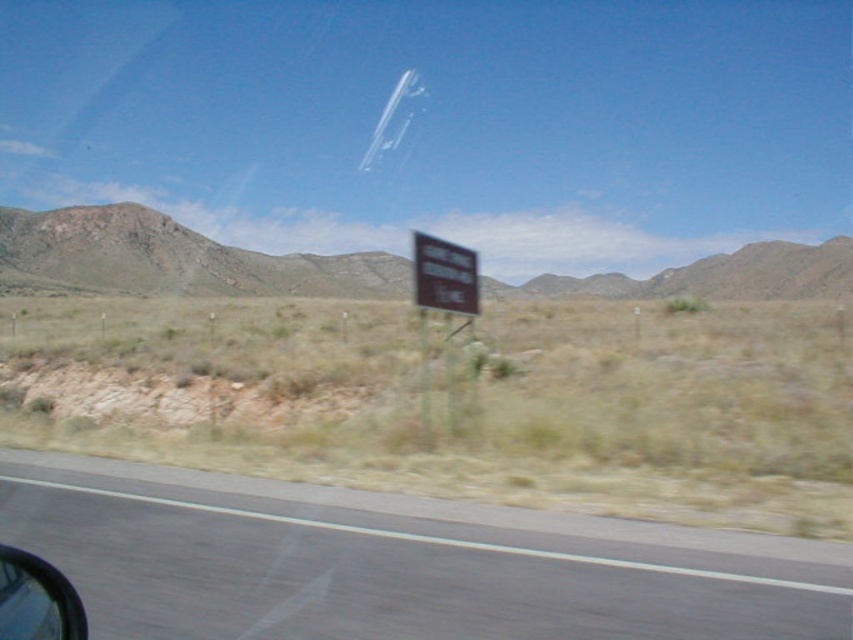
Is point (74, 429) less distant than point (436, 275)?

No, (74, 429) is further to viewer.

Who is more forward, (727, 433) or (448, 248)?

Point (727, 433)

Locate an element on the screen. This screenshot has width=853, height=640. brown grassland at center is located at coordinates (459, 401).

Does brown grassland at center come behind brown matte sign at center?

No, brown grassland at center is closer to the viewer.

Between point (770, 506) and point (415, 300), which one is positioned in front?

Positioned in front is point (770, 506).

Image resolution: width=853 pixels, height=640 pixels. I want to click on brown grassland at center, so click(459, 401).

Does brown grassland at center appear over black asphalt road at lower center?

Yes.

Does brown grassland at center appear under black asphalt road at lower center?

No, brown grassland at center is not below black asphalt road at lower center.

Does point (695, 461) come farther from viewer compared to point (57, 518)?

Yes.

I want to click on brown grassland at center, so (459, 401).